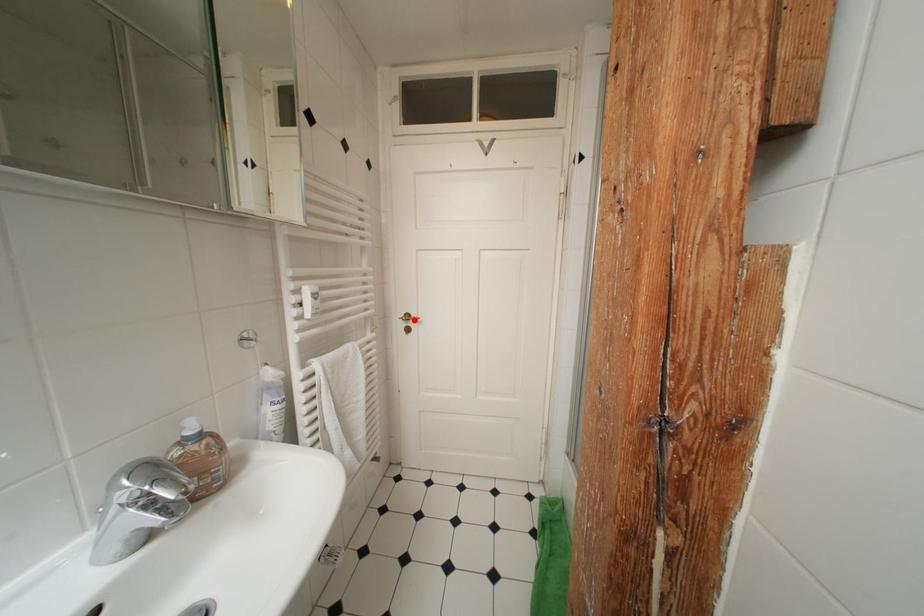
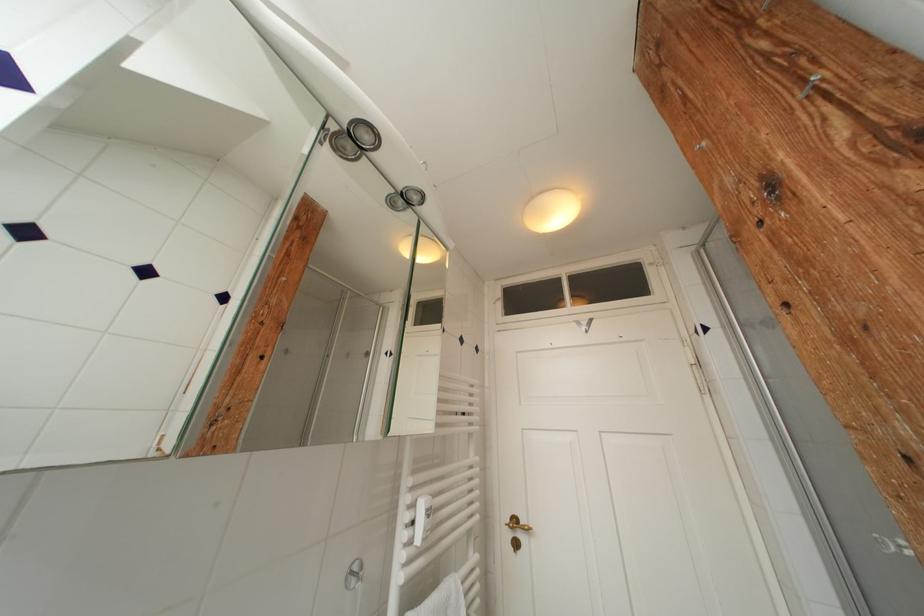
Question: I am providing you with two images of the same scene from different viewpoints. A red point is marked on the first image. At the location where the point appears in image 1, is it still visible in image 2?

Choices:
 (A) Yes
 (B) No

Answer: (A)